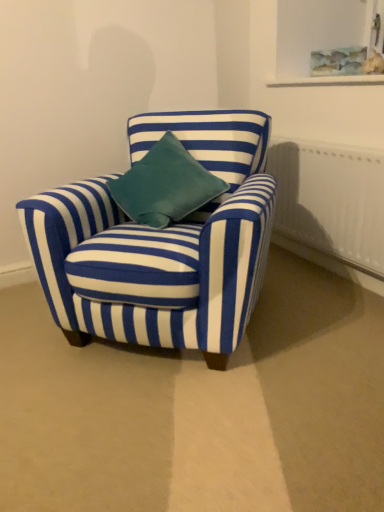
Question: Is blue striped fabric chair at center completely or partially outside of white textured radiator at right?

Choices:
 (A) yes
 (B) no

Answer: (A)

Question: From the image's perspective, is blue striped fabric chair at center beneath white textured radiator at right?

Choices:
 (A) no
 (B) yes

Answer: (B)

Question: Is blue striped fabric chair at center smaller than white textured radiator at right?

Choices:
 (A) no
 (B) yes

Answer: (A)

Question: Does blue striped fabric chair at center have a greater height compared to white textured radiator at right?

Choices:
 (A) no
 (B) yes

Answer: (B)

Question: From a real-world perspective, is blue striped fabric chair at center over white textured radiator at right?

Choices:
 (A) yes
 (B) no

Answer: (A)

Question: From the image's perspective, is blue striped fabric chair at center on white textured radiator at right?

Choices:
 (A) yes
 (B) no

Answer: (B)

Question: Can you confirm if white textured radiator at right is shorter than blue striped fabric chair at center?

Choices:
 (A) yes
 (B) no

Answer: (A)

Question: From a real-world perspective, is white textured radiator at right located beneath blue striped fabric chair at center?

Choices:
 (A) yes
 (B) no

Answer: (A)

Question: Can you confirm if white textured radiator at right is bigger than blue striped fabric chair at center?

Choices:
 (A) yes
 (B) no

Answer: (B)

Question: Can you confirm if white textured radiator at right is smaller than blue striped fabric chair at center?

Choices:
 (A) no
 (B) yes

Answer: (B)

Question: Considering the relative positions of white textured radiator at right and blue striped fabric chair at center in the image provided, is white textured radiator at right behind blue striped fabric chair at center?

Choices:
 (A) no
 (B) yes

Answer: (B)

Question: Is white textured radiator at right positioned beyond the bounds of blue striped fabric chair at center?

Choices:
 (A) yes
 (B) no

Answer: (A)

Question: Based on their positions, is blue striped fabric chair at center located to the left or right of white textured radiator at right?

Choices:
 (A) right
 (B) left

Answer: (B)